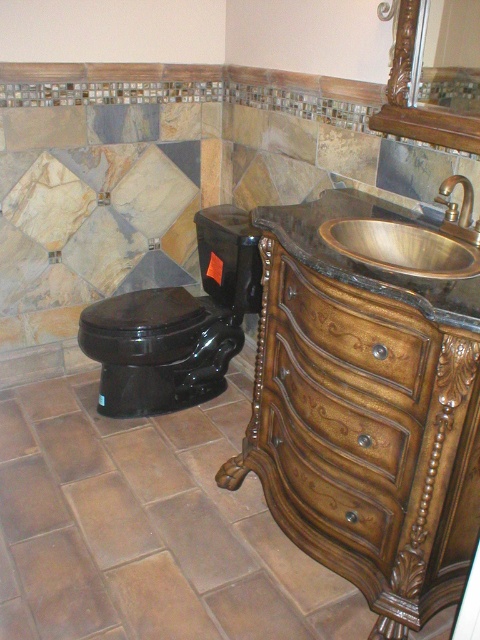
Is brass metallic sink at right taller than wooden frame at upper right?

In fact, brass metallic sink at right may be shorter than wooden frame at upper right.

Which is more to the right, brass metallic sink at right or wooden frame at upper right?

wooden frame at upper right is more to the right.

Consider the image. Measure the distance between brass metallic sink at right and camera.

1.33 meters

Locate an element on the screen. The height and width of the screenshot is (640, 480). brass metallic sink at right is located at coordinates (403, 248).

Which is below, glossy wood mirror at upper right or wooden frame at upper right?

wooden frame at upper right is below.

Can you confirm if glossy wood mirror at upper right is shorter than wooden frame at upper right?

Yes, glossy wood mirror at upper right is shorter than wooden frame at upper right.

You are a GUI agent. You are given a task and a screenshot of the screen. Output one action in this format:
    pyautogui.click(x=<x>, y=<y>)
    Task: Click on the glossy wood mirror at upper right
    This screenshot has width=480, height=640.
    Given the screenshot: What is the action you would take?
    pyautogui.click(x=448, y=58)

Is point (194, 218) closer to viewer compared to point (475, 68)?

No.

Find the location of a particular element. This screenshot has width=480, height=640. black glossy toilet at center is located at coordinates (178, 324).

Who is more distant from viewer, [218,284] or [455,90]?

Positioned behind is point [218,284].

Locate an element on the screen. black glossy toilet at center is located at coordinates (178, 324).